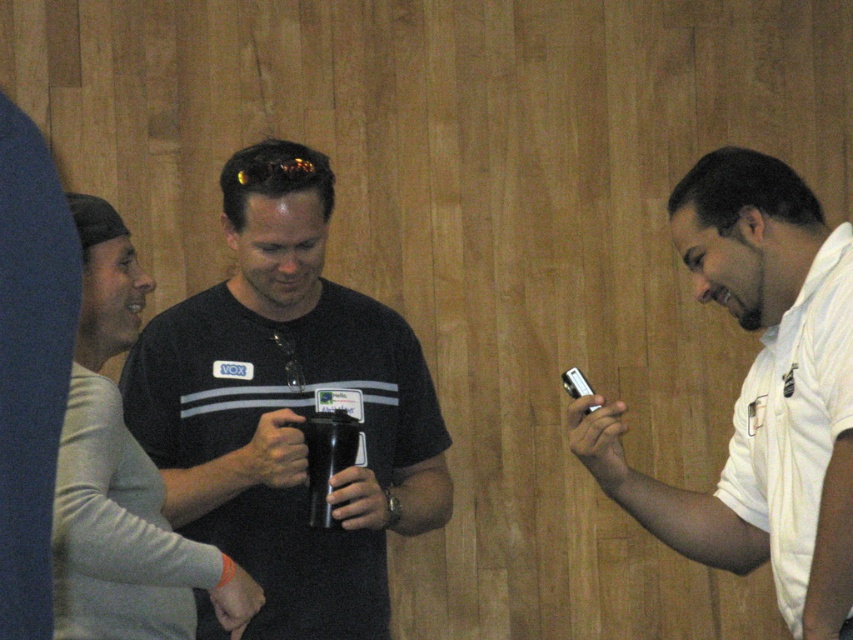
Can you confirm if white matte shirt at right is positioned above white cotton polo shirt at right?

Yes, white matte shirt at right is above white cotton polo shirt at right.

Is white matte shirt at right positioned behind white cotton polo shirt at right?

No, it is in front of white cotton polo shirt at right.

Image resolution: width=853 pixels, height=640 pixels. What do you see at coordinates (759, 392) in the screenshot?
I see `white matte shirt at right` at bounding box center [759, 392].

Find the location of `white matte shirt at right`. white matte shirt at right is located at coordinates (759, 392).

Which is below, black matte t-shirt at center or white cotton polo shirt at right?

white cotton polo shirt at right is lower down.

Which of these two, black matte t-shirt at center or white cotton polo shirt at right, stands taller?

With more height is black matte t-shirt at center.

Which is in front, point (285, 515) or point (850, 228)?

Point (850, 228) is in front.

Find the location of `black matte t-shirt at center`. black matte t-shirt at center is located at coordinates (x=288, y=408).

Does black matte t-shirt at center have a lesser height compared to white matte shirt at right?

No.

Is point (355, 394) positioned before point (801, 536)?

No, it is behind (801, 536).

Is point (210, 349) closer to viewer compared to point (827, 477)?

That is False.

Identify the location of black matte t-shirt at center. This screenshot has width=853, height=640. (288, 408).